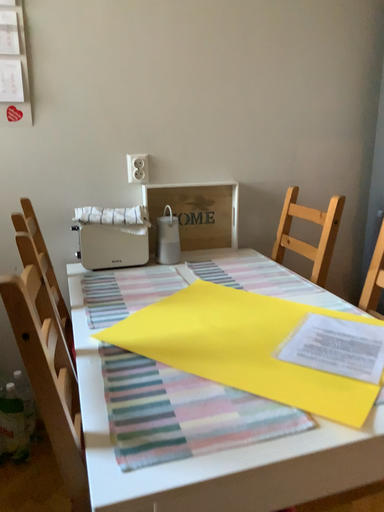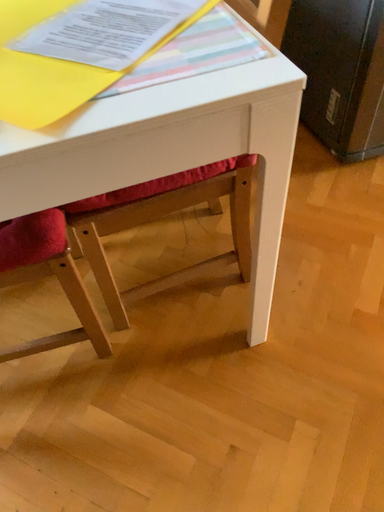
Question: Which way did the camera rotate in the video?

Choices:
 (A) rotated downward
 (B) rotated upward

Answer: (A)